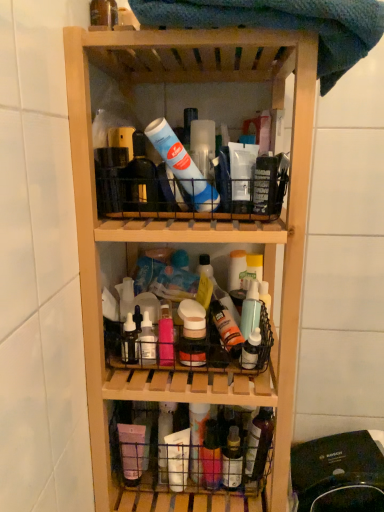
Identify the location of vacant area on top of natural wood shelf at center (from a real-world perspective). (205, 55).